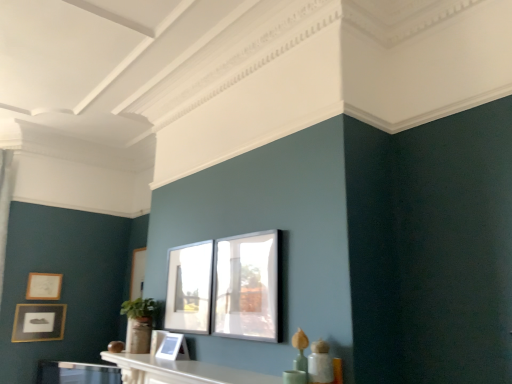
Question: In the image, is matte gold picture frame at left, arranged as the 4th picture frame when viewed from the front, on the left side or the right side of clear glass window at center?

Choices:
 (A) right
 (B) left

Answer: (B)

Question: From the image's perspective, is matte gold picture frame at left, the second picture frame when ordered from left to right, above or below clear glass window at center?

Choices:
 (A) above
 (B) below

Answer: (B)

Question: Which is farther from the matte glass picture frame at center, placed as the fourth picture frame when sorted from left to right?

Choices:
 (A) white marble mantel at lower center
 (B) matte gold picture frame at lower left, which ranks as the 1th picture frame in left-to-right order
 (C) clear glass window at center
 (D) matte white picture frame at center, which is the 2th picture frame from right to left
 (E) matte gold picture frame at left, arranged as the 4th picture frame when viewed from the front

Answer: (E)

Question: Estimate the real-world distances between objects in this image. Which object is closer to the matte gold picture frame at lower left, which is counted as the 3th picture frame, starting from the front?

Choices:
 (A) white marble mantel at lower center
 (B) matte white picture frame at center, arranged as the third picture frame when viewed from the back
 (C) matte glass picture frame at center, placed as the fourth picture frame when sorted from left to right
 (D) clear glass window at center
 (E) matte gold picture frame at left, arranged as the 4th picture frame when viewed from the front

Answer: (E)